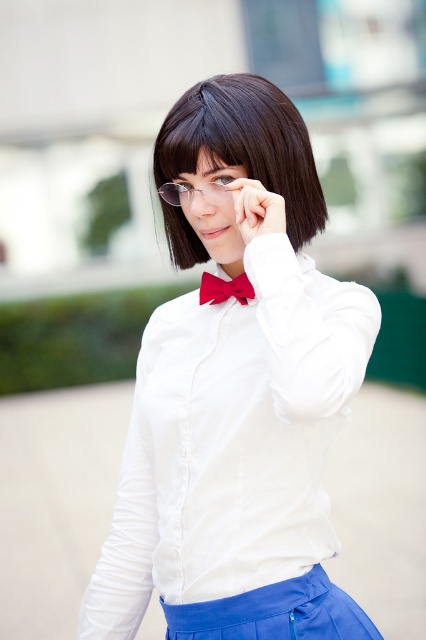
Describe the element at coordinates (236, 403) in the screenshot. This screenshot has height=640, width=426. I see `white satin blouse at center` at that location.

Which of these two, white satin blouse at center or matte white hand at center, stands shorter?

matte white hand at center

Who is more distant from viewer, (x=307, y=410) or (x=261, y=192)?

Positioned behind is point (x=261, y=192).

Locate an element on the screen. white satin blouse at center is located at coordinates (236, 403).

The image size is (426, 640). I want to click on dark brown silky hair at center, so click(x=245, y=144).

Does dark brown silky hair at center appear under black silky hair at upper center?

Yes.

Which is in front, point (311, 170) or point (187, 173)?

Point (187, 173) is more forward.

The image size is (426, 640). Identify the location of dark brown silky hair at center. (245, 144).

Which is behind, point (284, 205) or point (190, 195)?

Positioned behind is point (190, 195).

Is matte white hand at center bigger than clear plastic glasses at center?

Correct, matte white hand at center is larger in size than clear plastic glasses at center.

This screenshot has height=640, width=426. What do you see at coordinates (256, 209) in the screenshot?
I see `matte white hand at center` at bounding box center [256, 209].

The width and height of the screenshot is (426, 640). Identify the location of matte white hand at center. (256, 209).